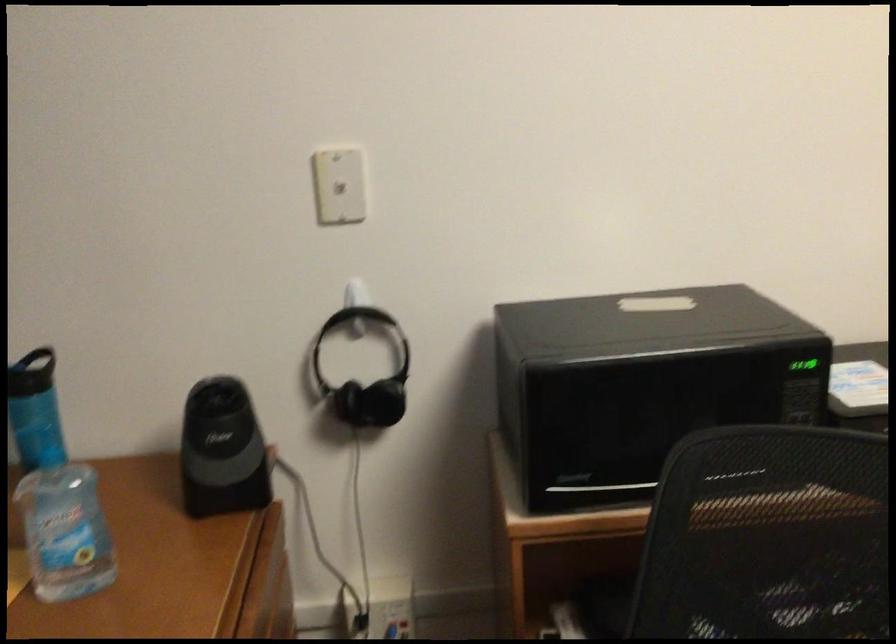
I want to click on bottle handle loop, so click(65, 532).